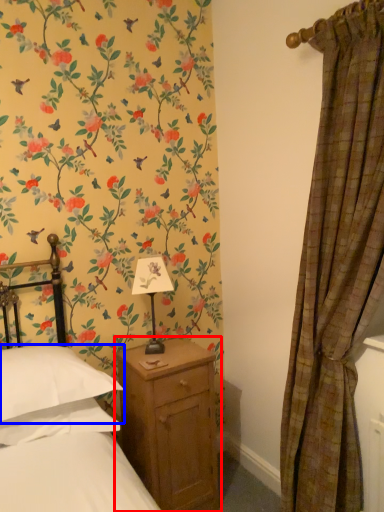
Question: Among these objects, which one is farthest to the camera, nightstand (highlighted by a red box) or pillow (highlighted by a blue box)?

Choices:
 (A) nightstand
 (B) pillow

Answer: (A)